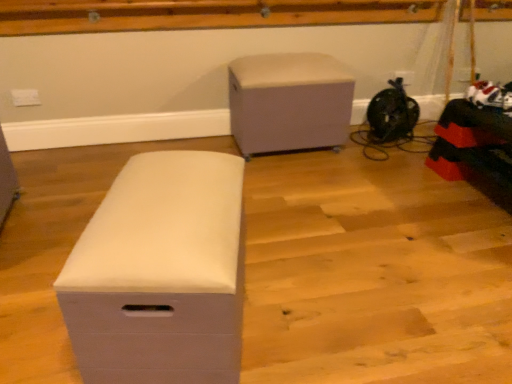
Image resolution: width=512 pixels, height=384 pixels. I want to click on empty space that is ontop of matte white storage box at center, acting as the first furniture starting from the bottom (from a real-world perspective), so click(165, 180).